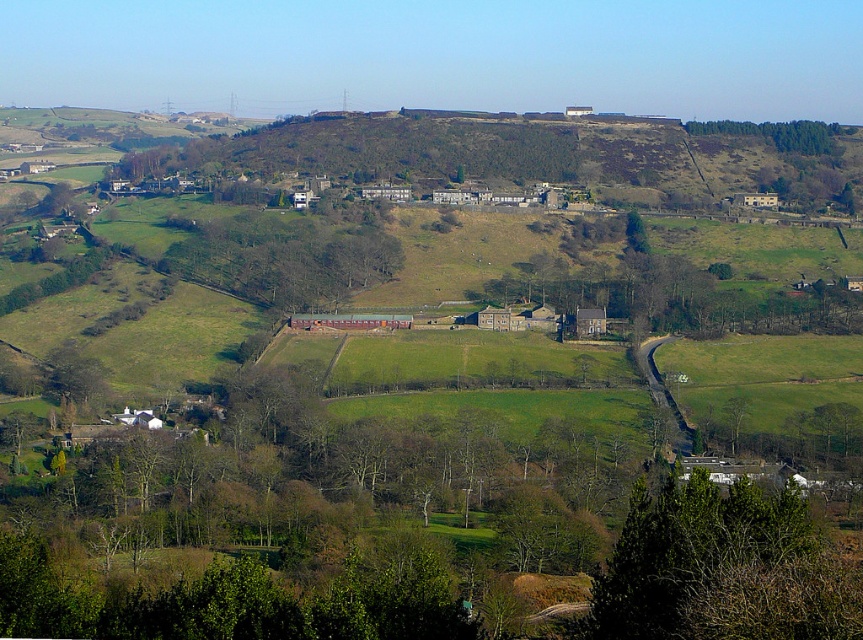
Question: Can you confirm if green leafy tree at lower right is thinner than green leafy trees at upper right?

Choices:
 (A) yes
 (B) no

Answer: (A)

Question: Does green leafy tree at lower right have a smaller size compared to brown wooden fence at center?

Choices:
 (A) yes
 (B) no

Answer: (A)

Question: Which point is farther from the camera taking this photo?

Choices:
 (A) (797, 132)
 (B) (237, 221)

Answer: (A)

Question: Among these objects, which one is farthest from the camera?

Choices:
 (A) green leafy trees at upper right
 (B) green leafy tree at lower right

Answer: (A)

Question: Does brown wooden fence at center appear over green leafy trees at upper right?

Choices:
 (A) no
 (B) yes

Answer: (A)

Question: Which of the following is the closest to the observer?

Choices:
 (A) green leafy trees at upper right
 (B) green leafy tree at lower right

Answer: (B)